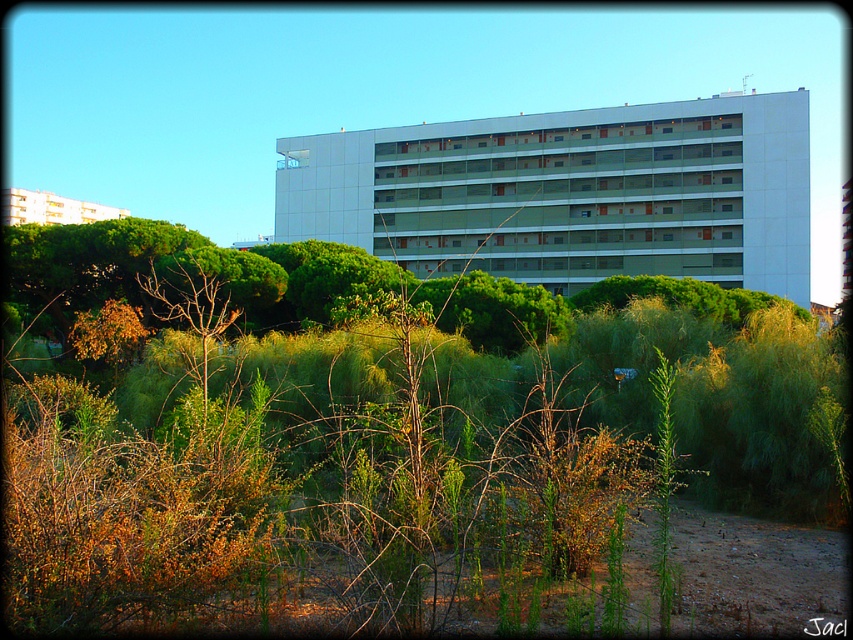
Question: Among these points, which one is farthest from the camera?

Choices:
 (A) 329,230
 (B) 3,216

Answer: (B)

Question: Which of the following is the farthest from the observer?

Choices:
 (A) (561, 259)
 (B) (68, 211)

Answer: (B)

Question: Can you confirm if white smooth building at center is smaller than white glossy building at upper left?

Choices:
 (A) yes
 (B) no

Answer: (A)

Question: Is white smooth building at center thinner than white glossy building at upper left?

Choices:
 (A) yes
 (B) no

Answer: (A)

Question: Which of the following is the closest to the observer?

Choices:
 (A) white glossy building at upper left
 (B) white smooth building at center

Answer: (A)

Question: Where is white smooth building at center located in relation to white glossy building at upper left in the image?

Choices:
 (A) above
 (B) below

Answer: (B)